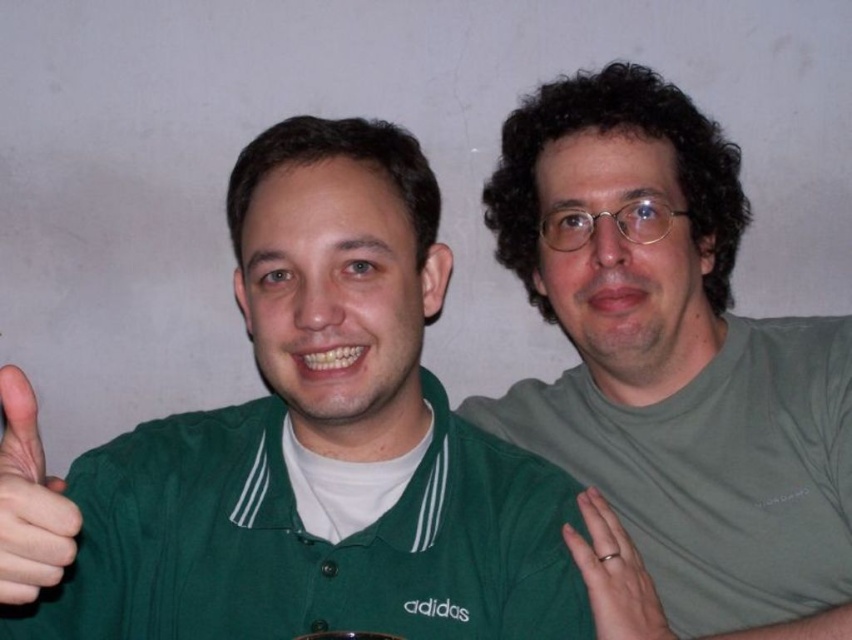
Question: Which point is farther from the camera taking this photo?

Choices:
 (A) (200, 560)
 (B) (684, 513)
 (C) (609, 532)

Answer: (B)

Question: Does green fabric shirt at left have a greater width compared to silver metallic ring at right?

Choices:
 (A) yes
 (B) no

Answer: (A)

Question: Among these objects, which one is farthest from the camera?

Choices:
 (A) green matte shirt at upper right
 (B) green fabric hand at left

Answer: (A)

Question: Can you confirm if green matte shirt at upper right is wider than silver metallic ring at right?

Choices:
 (A) no
 (B) yes

Answer: (B)

Question: Which of these objects is positioned farthest from the green fabric shirt at left?

Choices:
 (A) silver metallic ring at right
 (B) green fabric hand at left
 (C) green matte shirt at upper right

Answer: (C)

Question: Does green fabric hand at left appear on the right side of silver metallic ring at right?

Choices:
 (A) yes
 (B) no

Answer: (B)